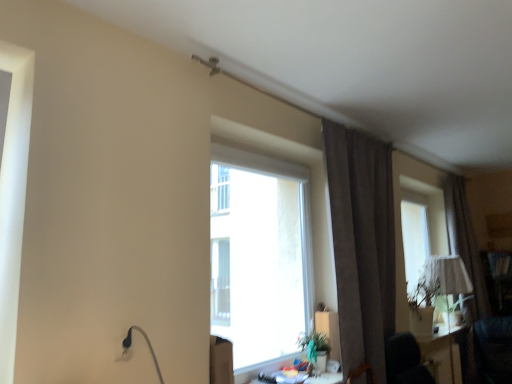
What do you see at coordinates (308, 378) in the screenshot? This screenshot has height=384, width=512. I see `wooden desk at lower center, the second table positioned from the bottom` at bounding box center [308, 378].

Where is `transparent glass window at center`? The image size is (512, 384). transparent glass window at center is located at coordinates (260, 255).

This screenshot has width=512, height=384. Describe the element at coordinates (465, 244) in the screenshot. I see `brown fabric curtain at right, which is counted as the 2th curtain, starting from the front` at that location.

The height and width of the screenshot is (384, 512). In order to click on matte white lampshade at right in this screenshot , I will do `click(448, 275)`.

At what (x,y) coordinates should I click in order to perform the action: click on matte white table at lower right, which appears as the second table when viewed from the left. Please return your answer as a coordinate pair (x, y). Looking at the image, I should click on [x=443, y=354].

How much space does matte white table at lower right, arranged as the first table when viewed from the back, occupy horizontally?

matte white table at lower right, arranged as the first table when viewed from the back, is 8.20 inches wide.

Locate an element on the screen. brown velvet curtain at upper right, which appears as the first curtain when viewed from the left is located at coordinates (362, 244).

Could you tell me if brown velvet curtain at upper right, marked as the second curtain in a right-to-left arrangement, is turned towards transparent glass window at center?

No, brown velvet curtain at upper right, marked as the second curtain in a right-to-left arrangement, is not facing towards transparent glass window at center.

Looking at this image, between brown velvet curtain at upper right, which is the 1th curtain from front to back, and transparent glass window at center, which one has smaller width?

With smaller width is transparent glass window at center.

Visually, is brown velvet curtain at upper right, which appears as the first curtain when viewed from the left, positioned to the left or to the right of transparent glass window at center?

Based on their positions, brown velvet curtain at upper right, which appears as the first curtain when viewed from the left, is located to the right of transparent glass window at center.

Measure the distance between brown velvet curtain at upper right, the second curtain when ordered from back to front, and transparent glass window at center.

brown velvet curtain at upper right, the second curtain when ordered from back to front, and transparent glass window at center are 21.22 inches apart.

From the picture: How different are the orientations of brown fabric curtain at right, which is counted as the second curtain, starting from the left, and matte white lampshade at right in degrees?

The facing directions of brown fabric curtain at right, which is counted as the second curtain, starting from the left, and matte white lampshade at right are 1.17 degrees apart.

Which is behind, brown fabric curtain at right, the first curtain when ordered from back to front, or matte white lampshade at right?

matte white lampshade at right.

Is brown fabric curtain at right, which is counted as the 2th curtain, starting from the front, completely or partially outside of matte white lampshade at right?

brown fabric curtain at right, which is counted as the 2th curtain, starting from the front, is positioned outside matte white lampshade at right.

Locate an element on the screen. curtain above the brown fabric curtain at right, the first curtain when ordered from back to front (from the image's perspective) is located at coordinates (362, 244).

Does brown velvet curtain at upper right, which appears as the first curtain when viewed from the left, have a lesser width compared to brown fabric curtain at right, the 1th curtain viewed from the right?

No.

Which of these two, brown velvet curtain at upper right, which appears as the first curtain when viewed from the left, or brown fabric curtain at right, which is counted as the 2th curtain, starting from the front, is bigger?

brown velvet curtain at upper right, which appears as the first curtain when viewed from the left, is bigger.

From the image's perspective, which is above, brown velvet curtain at upper right, which appears as the first curtain when viewed from the left, or brown fabric curtain at right, which is counted as the 2th curtain, starting from the front?

From the image's view, brown velvet curtain at upper right, which appears as the first curtain when viewed from the left, is above.

Are wooden desk at lower center, the 2th table viewed from the back, and transparent glass window at center located far from each other?

Actually, wooden desk at lower center, the 2th table viewed from the back, and transparent glass window at center are a little close together.

Consider the image. From the image's perspective, which object appears higher, wooden desk at lower center, placed as the second table when sorted from right to left, or transparent glass window at center?

transparent glass window at center.

Which is less distant, (309,380) or (263,296)?

The point (309,380) is closer.

Is the depth of wooden desk at lower center, the 2th table viewed from the back, greater than that of transparent glass window at center?

Yes, it is.

Which is behind, point (342, 149) or point (446, 334)?

The point (446, 334) is more distant.

Is matte white table at lower right, the first table viewed from the right, at the back of brown velvet curtain at upper right, which is the 1th curtain from front to back?

brown velvet curtain at upper right, which is the 1th curtain from front to back, does not have its back to matte white table at lower right, the first table viewed from the right.

Is brown velvet curtain at upper right, which is the 1th curtain from front to back, spatially inside matte white table at lower right, placed as the first table when sorted from bottom to top, or outside of it?

brown velvet curtain at upper right, which is the 1th curtain from front to back, cannot be found inside matte white table at lower right, placed as the first table when sorted from bottom to top.

Between brown velvet curtain at upper right, the second curtain when ordered from back to front, and matte white table at lower right, which appears as the second table when viewed from the left, which one has larger width?

Wider between the two is brown velvet curtain at upper right, the second curtain when ordered from back to front.

Where is `table that is the 2nd object located below the transparent glass window at center (from the image's perspective)`? Image resolution: width=512 pixels, height=384 pixels. table that is the 2nd object located below the transparent glass window at center (from the image's perspective) is located at coordinates (443, 354).

From the image's perspective, which object appears higher, matte white table at lower right, which appears as the second table when viewed from the left, or transparent glass window at center?

transparent glass window at center, from the image's perspective.

Does matte white table at lower right, arranged as the first table when viewed from the back, turn towards transparent glass window at center?

No, matte white table at lower right, arranged as the first table when viewed from the back, is not facing towards transparent glass window at center.

Considering the sizes of objects matte white table at lower right, the second table viewed from the top, and transparent glass window at center in the image provided, who is smaller, matte white table at lower right, the second table viewed from the top, or transparent glass window at center?

With smaller size is matte white table at lower right, the second table viewed from the top.

Does wooden desk at lower center, placed as the second table when sorted from right to left, turn towards matte white lampshade at right?

No, wooden desk at lower center, placed as the second table when sorted from right to left, is not oriented towards matte white lampshade at right.

From the image's perspective, is wooden desk at lower center, the 2th table viewed from the back, beneath matte white lampshade at right?

Yes, from the image's perspective, wooden desk at lower center, the 2th table viewed from the back, is beneath matte white lampshade at right.

Between wooden desk at lower center, placed as the second table when sorted from right to left, and matte white lampshade at right, which one has smaller width?

Thinner between the two is wooden desk at lower center, placed as the second table when sorted from right to left.

The image size is (512, 384). I want to click on table lamp that is behind the wooden desk at lower center, the first table when ordered from left to right, so click(x=448, y=275).

Identify the location of window lying in front of the brown velvet curtain at upper right, which appears as the first curtain when viewed from the left. The width and height of the screenshot is (512, 384). (260, 255).

You are a GUI agent. You are given a task and a screenshot of the screen. Output one action in this format:
    pyautogui.click(x=<x>, y=<y>)
    Task: Click on the table lamp beneath the brown fabric curtain at right, the first curtain when ordered from back to front (from a real-world perspective)
    The image size is (512, 384).
    Given the screenshot: What is the action you would take?
    pyautogui.click(x=448, y=275)

Based on their spatial positions, is matte white lampshade at right or wooden desk at lower center, the 2th table viewed from the back, further from transparent glass window at center?

Based on the image, matte white lampshade at right appears to be further to transparent glass window at center.

Considering their positions, is transparent glass window at center positioned closer to matte white table at lower right, which appears as the second table when viewed from the left, than matte white lampshade at right?

The object closer to matte white table at lower right, which appears as the second table when viewed from the left, is matte white lampshade at right.

Estimate the real-world distances between objects in this image. Which object is further from matte white lampshade at right, brown fabric curtain at right, the 1th curtain viewed from the right, or brown velvet curtain at upper right, which is the 1th curtain from front to back?

brown velvet curtain at upper right, which is the 1th curtain from front to back, is further to matte white lampshade at right.

Looking at the image, which one is located further to brown velvet curtain at upper right, which appears as the first curtain when viewed from the left, brown fabric curtain at right, which is counted as the 2th curtain, starting from the front, or wooden desk at lower center, the 2th table viewed from the back?

brown fabric curtain at right, which is counted as the 2th curtain, starting from the front, is positioned further to the anchor brown velvet curtain at upper right, which appears as the first curtain when viewed from the left.

Estimate the real-world distances between objects in this image. Which object is closer to matte white lampshade at right, brown fabric curtain at right, the 1th curtain viewed from the right, or matte white table at lower right, the first table viewed from the right?

matte white table at lower right, the first table viewed from the right.

When comparing their distances from wooden desk at lower center, the 2th table viewed from the back, does brown velvet curtain at upper right, which is the 1th curtain from front to back, or brown fabric curtain at right, which is counted as the 2th curtain, starting from the front, seem closer?

brown velvet curtain at upper right, which is the 1th curtain from front to back.

Looking at the image, which one is located further to brown fabric curtain at right, which is counted as the 2th curtain, starting from the front, matte white lampshade at right or wooden desk at lower center, placed as the second table when sorted from right to left?

wooden desk at lower center, placed as the second table when sorted from right to left.

From the picture: From the image, which object appears to be farther from brown fabric curtain at right, which is counted as the second curtain, starting from the left, wooden desk at lower center, the second table positioned from the bottom, or matte white table at lower right, placed as the first table when sorted from bottom to top?

wooden desk at lower center, the second table positioned from the bottom, is further to brown fabric curtain at right, which is counted as the second curtain, starting from the left.

This screenshot has width=512, height=384. Find the location of `table lamp located between transparent glass window at center and brown fabric curtain at right, which is counted as the second curtain, starting from the left, in the left-right direction`. table lamp located between transparent glass window at center and brown fabric curtain at right, which is counted as the second curtain, starting from the left, in the left-right direction is located at coordinates (448, 275).

I want to click on table between brown velvet curtain at upper right, which appears as the first curtain when viewed from the left, and matte white lampshade at right, along the z-axis, so click(x=443, y=354).

Where is `table located between wooden desk at lower center, which is the first table in top-to-bottom order, and brown fabric curtain at right, the 1th curtain viewed from the right, in the left-right direction`? table located between wooden desk at lower center, which is the first table in top-to-bottom order, and brown fabric curtain at right, the 1th curtain viewed from the right, in the left-right direction is located at coordinates (443, 354).

Locate an element on the screen. This screenshot has width=512, height=384. table lamp that lies between brown fabric curtain at right, the first curtain when ordered from back to front, and matte white table at lower right, placed as the first table when sorted from bottom to top, from top to bottom is located at coordinates (448, 275).